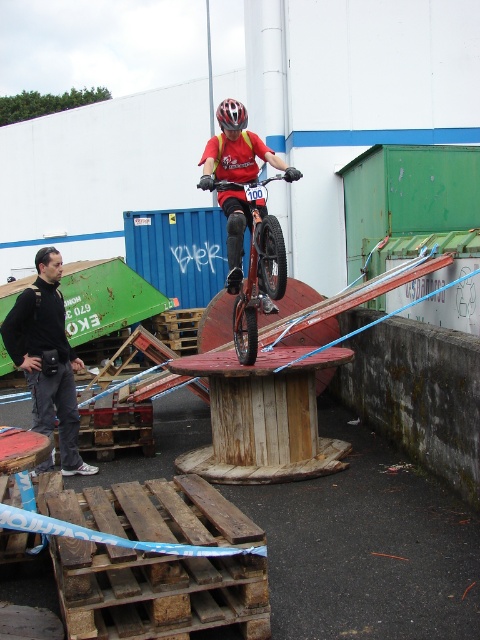
Question: Can you confirm if black fabric camera at left is positioned to the left of black matte bicycle helmet at upper center?

Choices:
 (A) no
 (B) yes

Answer: (B)

Question: Among these points, which one is nearest to the camera?

Choices:
 (A) (232, 314)
 (B) (76, 460)

Answer: (B)

Question: Which object appears farthest from the camera in this image?

Choices:
 (A) black matte bicycle helmet at upper center
 (B) orange matte mountain bike at center
 (C) black fabric camera at left

Answer: (C)

Question: Can you confirm if black fabric camera at left is positioned to the left of black matte bicycle helmet at upper center?

Choices:
 (A) yes
 (B) no

Answer: (A)

Question: Which object appears farthest from the camera in this image?

Choices:
 (A) black fabric camera at left
 (B) orange matte mountain bike at center
 (C) black matte bicycle helmet at upper center

Answer: (A)

Question: Does black fabric camera at left come behind black matte bicycle helmet at upper center?

Choices:
 (A) yes
 (B) no

Answer: (A)